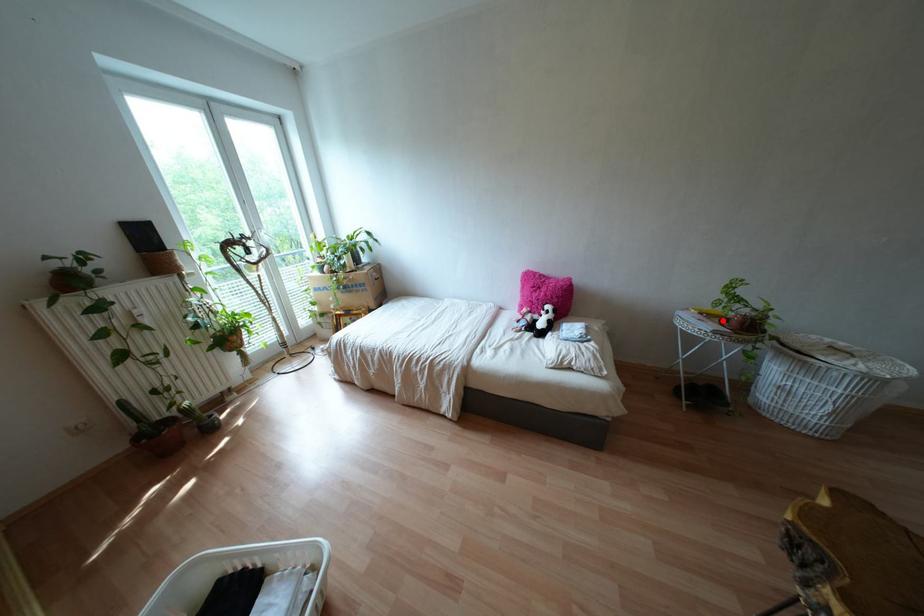
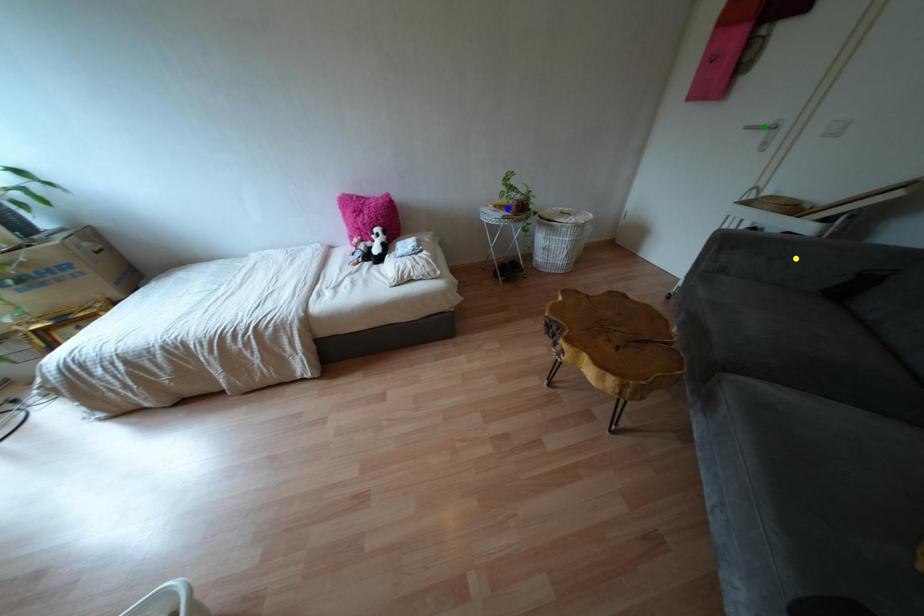
Question: I am providing you with two images of the same scene from different viewpoints. A red point is marked on the first image. You are given multiple points on the second image. Which point in image 2 is actually the same real-world point as the red point in image 1?

Choices:
 (A) green point
 (B) yellow point
 (C) blue point

Answer: (C)